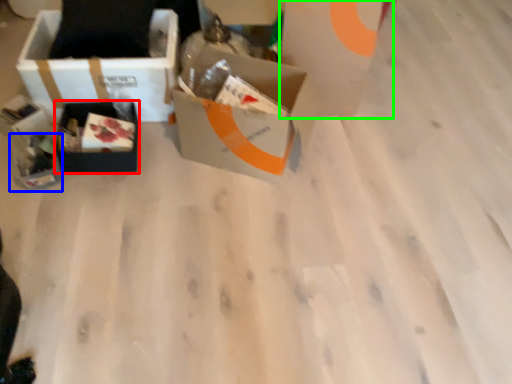
Question: Which is farther away from box (highlighted by a red box)? gift box (highlighted by a blue box) or cardboard box (highlighted by a green box)?

Choices:
 (A) gift box
 (B) cardboard box

Answer: (B)